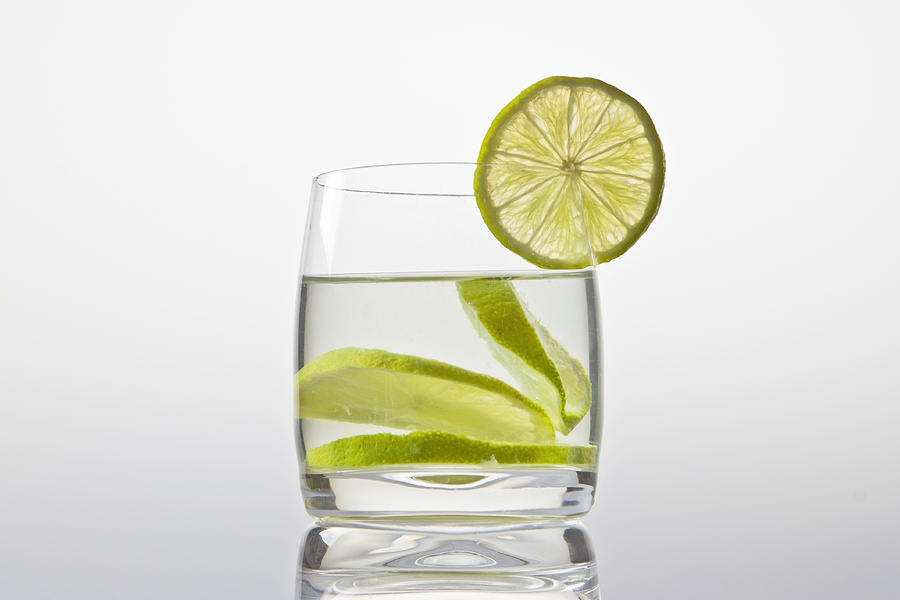
The image size is (900, 600). Find the location of `glass`. glass is located at coordinates (385, 225).